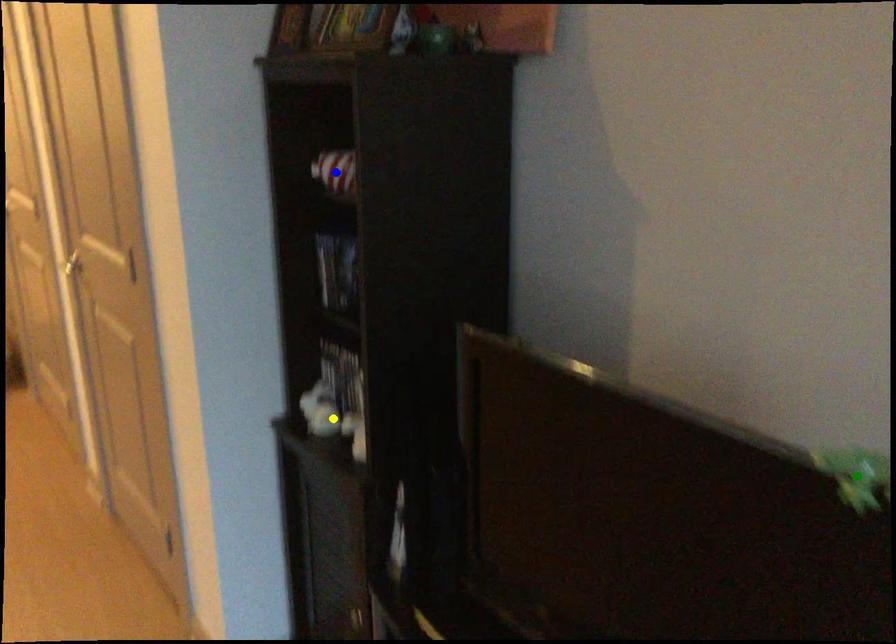
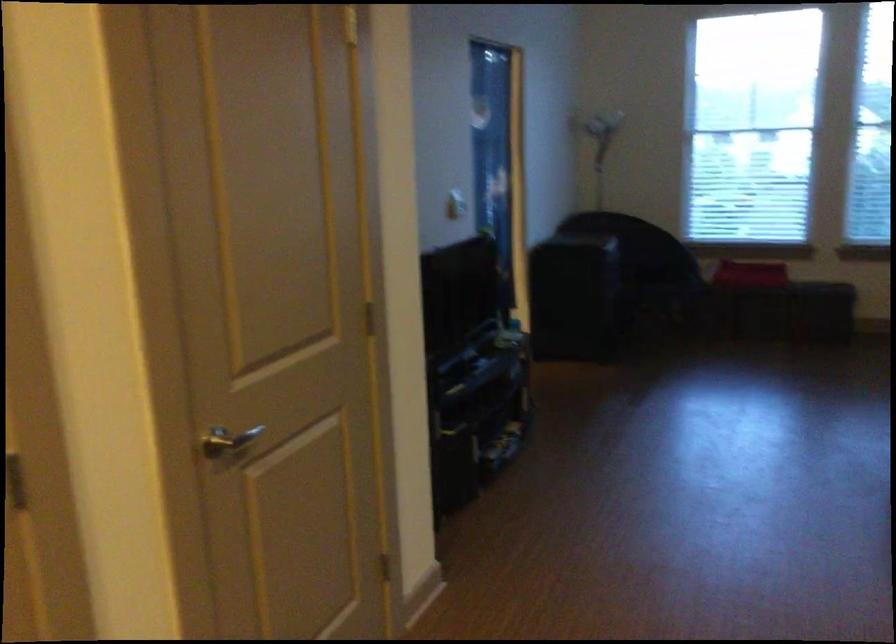
I am providing you with two images of the same scene from different viewpoints. Three points are marked in image1. Which point corresponds to a part or object that is occluded in image2?In image1, three points are marked. Which of them correspond to a part or object that is occluded in image2?Among the three points shown in image1, which one corresponds to a part or object that is no longer visible due to occlusion in image2?

green point, blue point, yellow point cannot be seen in image2.